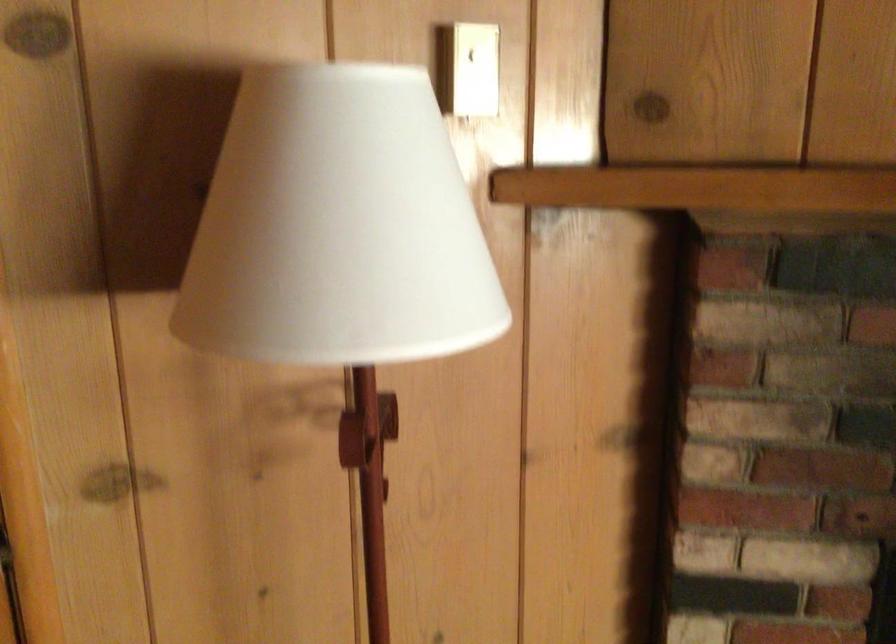
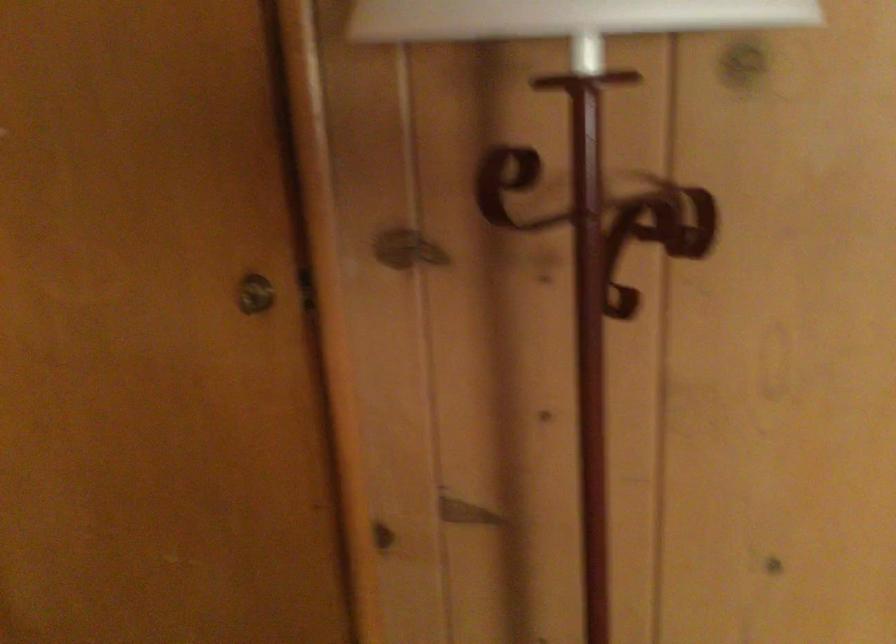
Question: Based on the continuous images, in which direction is the camera rotating? Reply with the corresponding letter.

Choices:
 (A) Left
 (B) Right
 (C) Up
 (D) Down

Answer: (A)